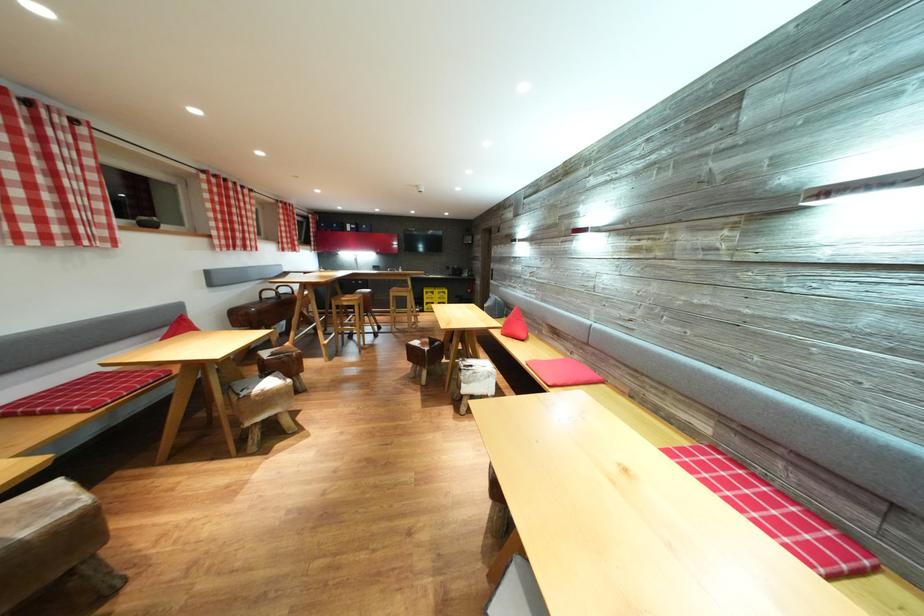
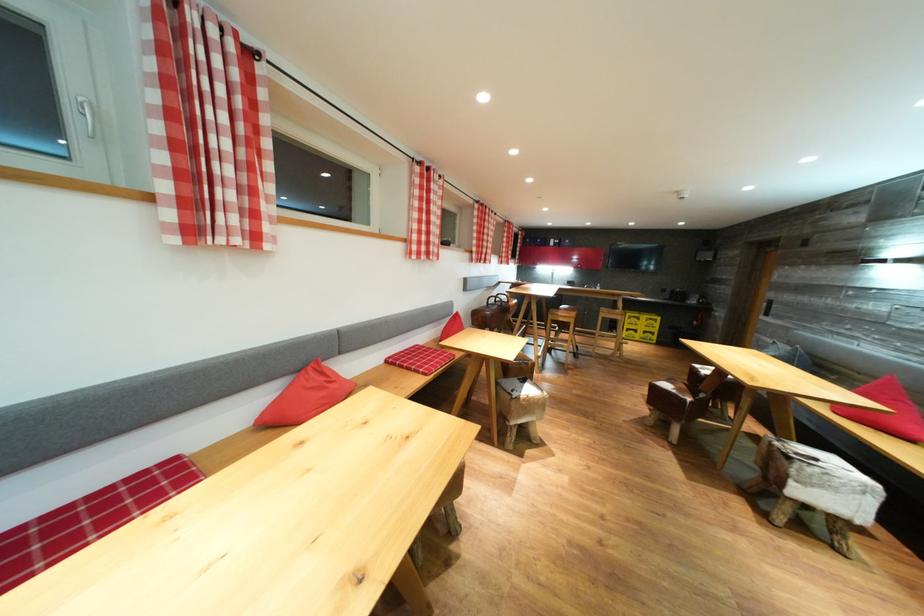
The point at (444, 297) is marked in the first image. Where is the corresponding point in the second image?

(650, 323)